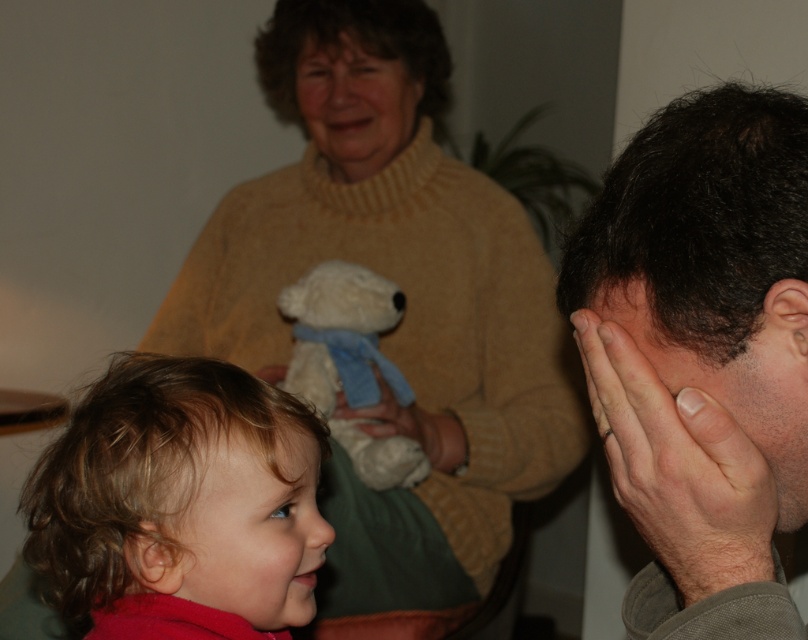
From the picture: You are standing at point (74,476) and want to move to point (287,19). Is there any obstruction between your current position and the target point?

Point (287,19) is behind point (74,476), so there is an obstruction between your current position and the target point.

You are a photographer standing at point (242,432). You want to capture a photo of the young child with light brown, slightly tousled hair wearing a red garment and the older woman holding a plush toy resembling a polar bear with a blue ribbon around its neck. Are both subjects within your field of view?

Yes, both the young child with light brown, slightly tousled hair wearing a red garment and the older woman holding a plush toy resembling a polar bear with a blue ribbon around its neck are within your field of view from point (242,432).